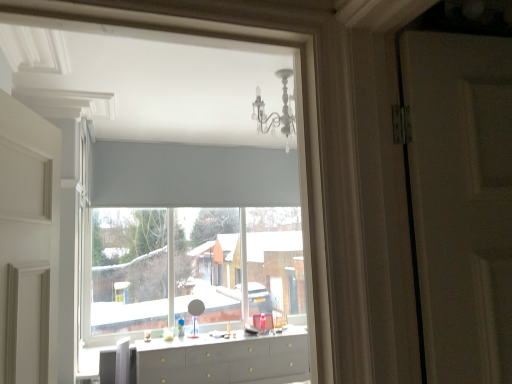
Question: Is white plastic swivel chair at lower left smaller than white matte window at center?

Choices:
 (A) yes
 (B) no

Answer: (A)

Question: From a real-world perspective, is white plastic swivel chair at lower left positioned over white matte window at center based on gravity?

Choices:
 (A) no
 (B) yes

Answer: (A)

Question: Is white plastic swivel chair at lower left closer to camera compared to white matte window at center?

Choices:
 (A) no
 (B) yes

Answer: (B)

Question: Considering the relative sizes of white plastic swivel chair at lower left and white matte window at center in the image provided, is white plastic swivel chair at lower left thinner than white matte window at center?

Choices:
 (A) yes
 (B) no

Answer: (B)

Question: Considering the relative sizes of white plastic swivel chair at lower left and white matte window at center in the image provided, is white plastic swivel chair at lower left taller than white matte window at center?

Choices:
 (A) no
 (B) yes

Answer: (A)

Question: Considering their positions, is white glossy counter top at center located in front of or behind white matte window at center?

Choices:
 (A) behind
 (B) front

Answer: (B)

Question: Looking at the image, does white glossy counter top at center seem bigger or smaller compared to white matte window at center?

Choices:
 (A) small
 (B) big

Answer: (A)

Question: From a real-world perspective, is white glossy counter top at center above or below white matte window at center?

Choices:
 (A) below
 (B) above

Answer: (A)

Question: Is white glossy counter top at center to the left or to the right of white matte window at center in the image?

Choices:
 (A) right
 (B) left

Answer: (A)

Question: In terms of size, does white matte window at center appear bigger or smaller than white glossy counter top at center?

Choices:
 (A) small
 (B) big

Answer: (B)

Question: Does point (106, 304) appear closer or farther from the camera than point (293, 334)?

Choices:
 (A) farther
 (B) closer

Answer: (A)

Question: From the image's perspective, is white matte window at center located above or below white glossy counter top at center?

Choices:
 (A) below
 (B) above

Answer: (B)

Question: Based on their positions, is white matte window at center located to the left or right of white glossy counter top at center?

Choices:
 (A) left
 (B) right

Answer: (A)

Question: Relative to white matte window at center, is matte gray dresser at center in front or behind?

Choices:
 (A) behind
 (B) front

Answer: (B)

Question: Would you say matte gray dresser at center is to the left or to the right of white matte window at center in the picture?

Choices:
 (A) right
 (B) left

Answer: (A)